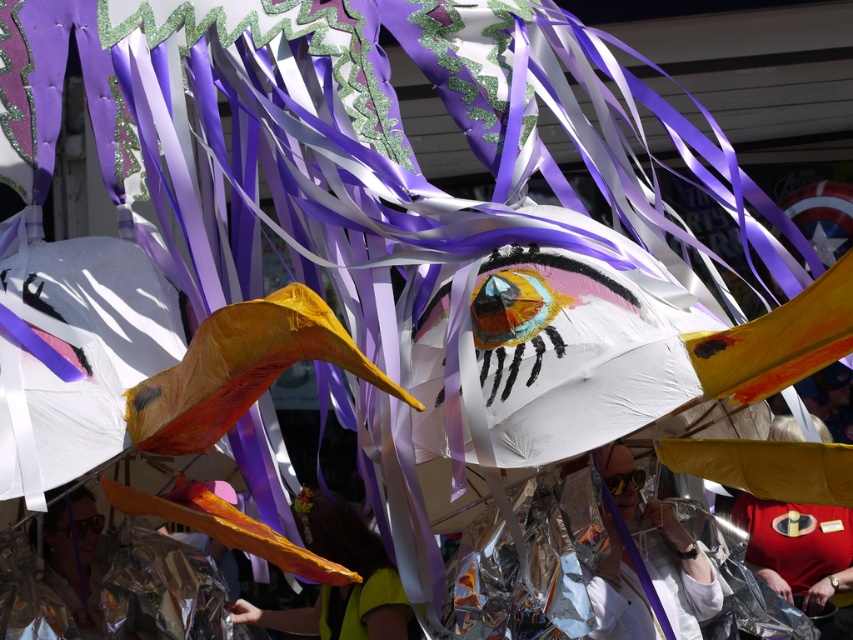
You are a photographer at the festival and want to capture both the red fabric shirt at lower right and the yellow fabric at center in the same frame. Since you can only focus on one object at a time, which one should you focus on to ensure the other is still in the background?

You should focus on the yellow fabric at center because the red fabric shirt at lower right is to the right of it, so the shirt will remain in the background if the yellow fabric is the main focus.

You are standing in the middle of the festival parade and see two points marked on the large kite structure. The first point is at coordinates point (820, 593) and the second is at point (366, 589). Which point is closer to you?

Point (820, 593) is further to the viewer than point (366, 589), so the point closer to you is point (366, 589).

You are a photographer trying to capture the festive scene. You want to ensure the shiny metallic mask at center and the red fabric shirt at lower right are both visible in your photo. Based on their positions, which object should you focus on first to ensure both are in frame?

The shiny metallic mask at center is located below the red fabric shirt at lower right. To ensure both are in frame, focus on the red fabric shirt at lower right first as it is higher up, allowing the mask below to naturally fall into the shot.